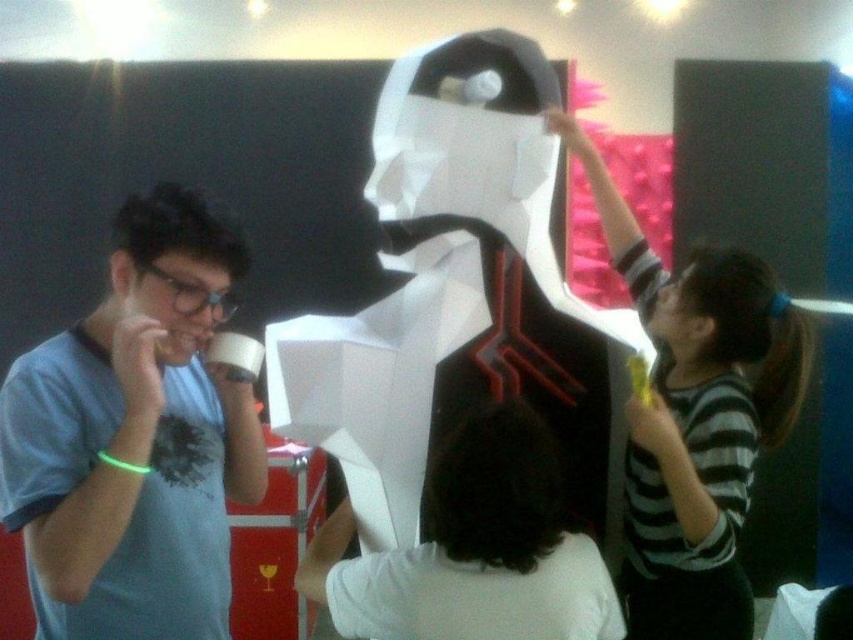
Question: Which object is the farthest from the light blue t-shirt at left?

Choices:
 (A) striped shirt at upper right
 (B) white paper sculpture at center
 (C) white matte shirt at center

Answer: (A)

Question: Can you confirm if light blue t-shirt at left is bigger than striped shirt at upper right?

Choices:
 (A) no
 (B) yes

Answer: (A)

Question: Can you confirm if light blue t-shirt at left is positioned above striped shirt at upper right?

Choices:
 (A) yes
 (B) no

Answer: (B)

Question: Is light blue t-shirt at left to the right of white matte shirt at center from the viewer's perspective?

Choices:
 (A) no
 (B) yes

Answer: (A)

Question: Which point is closer to the camera?

Choices:
 (A) (706, 332)
 (B) (80, 572)

Answer: (B)

Question: Which object is positioned closest to the light blue t-shirt at left?

Choices:
 (A) striped shirt at upper right
 (B) white matte shirt at center
 (C) white paper sculpture at center

Answer: (C)